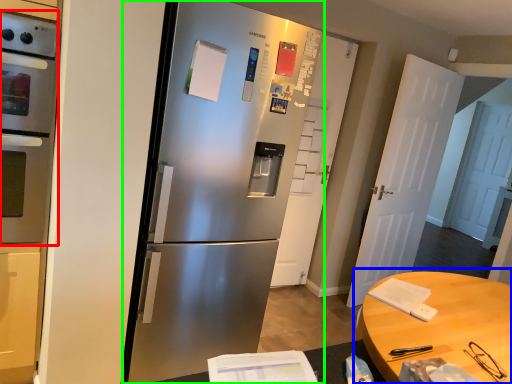
Question: Which object is positioned farthest from oven (highlighted by a red box)? Select from table (highlighted by a blue box) and refrigerator (highlighted by a green box).

Choices:
 (A) table
 (B) refrigerator

Answer: (A)